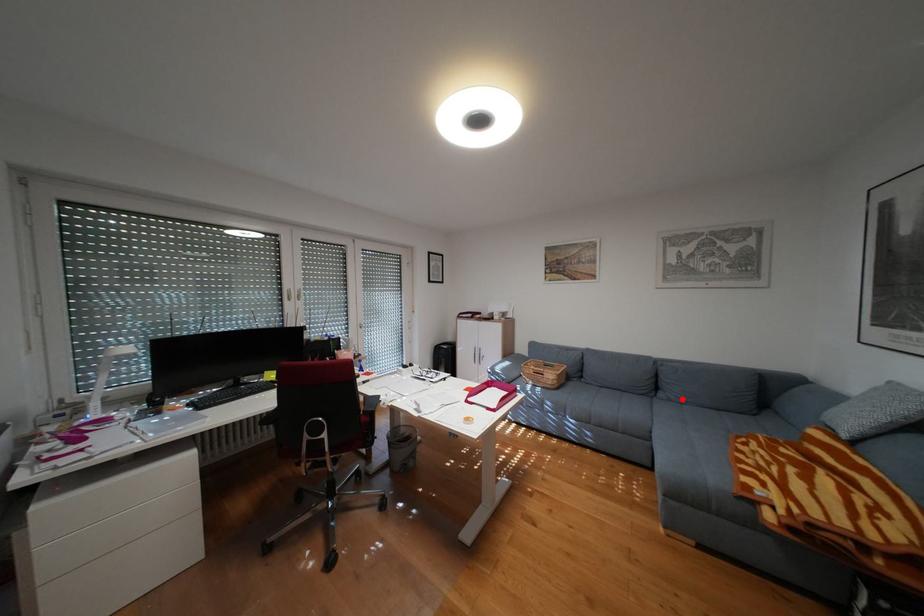
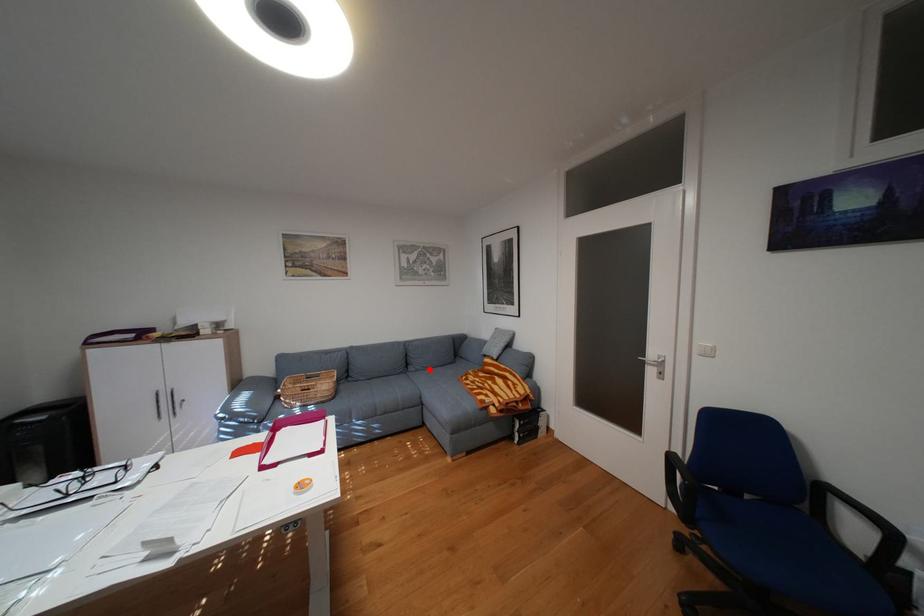
I am providing you with two images of the same scene from different viewpoints. A red point is marked on the first image and another point is marked on the second image. Is the red point in image1 aligned with the point shown in image2?

Yes